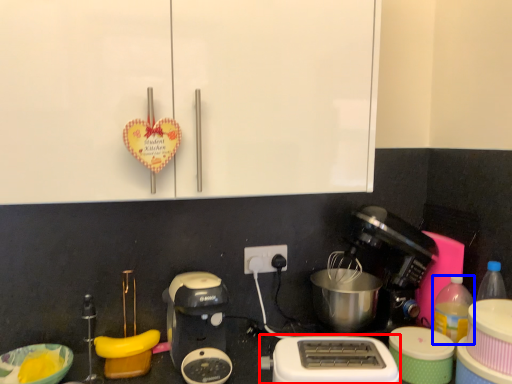
Question: Among these objects, which one is nearest to the camera, toaster (highlighted by a red box) or bottle (highlighted by a blue box)?

Choices:
 (A) toaster
 (B) bottle

Answer: (A)